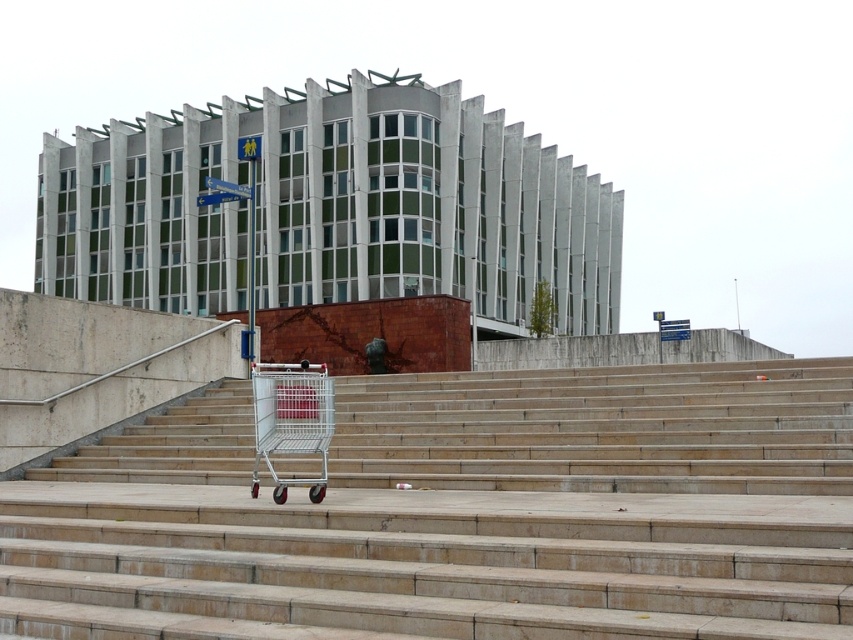
Question: Which point is farther from the camera taking this photo?

Choices:
 (A) (454, 512)
 (B) (306, 396)

Answer: (B)

Question: Can you confirm if smooth concrete stairs at center is positioned below silver metallic shopping cart at lower center?

Choices:
 (A) yes
 (B) no

Answer: (A)

Question: Can you confirm if smooth concrete stairs at center is positioned to the right of silver metallic shopping cart at lower center?

Choices:
 (A) no
 (B) yes

Answer: (B)

Question: Among these points, which one is nearest to the camera?

Choices:
 (A) tap(151, 557)
 (B) tap(254, 412)

Answer: (A)

Question: Is smooth concrete stairs at center wider than silver metallic shopping cart at lower center?

Choices:
 (A) yes
 (B) no

Answer: (A)